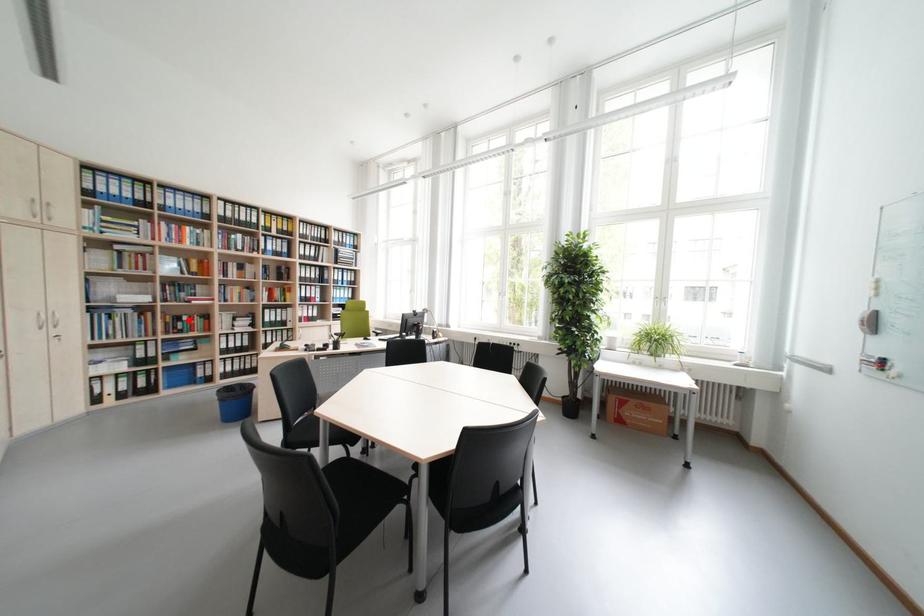
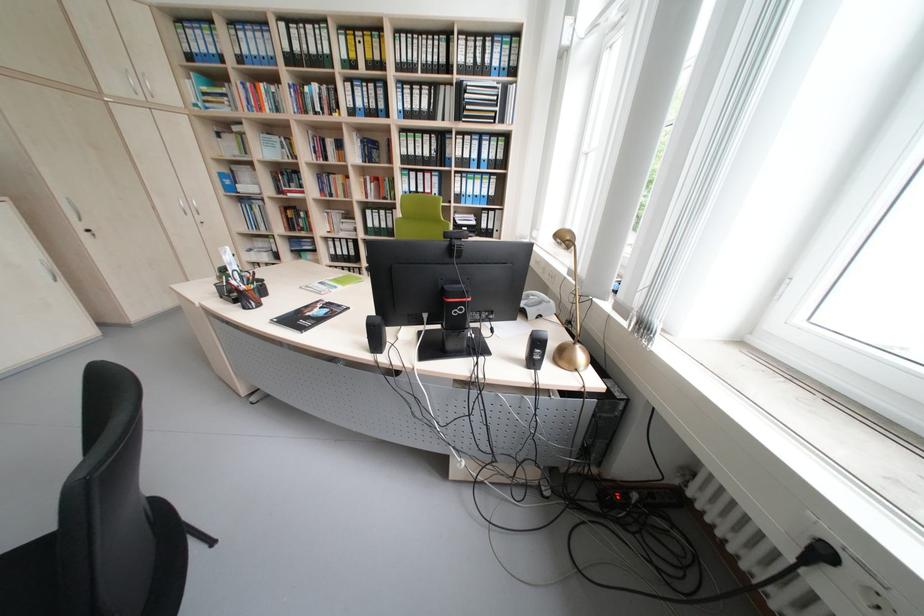
Where in the second image is the point corresponding to the highlighted location from the first image?

(309, 217)